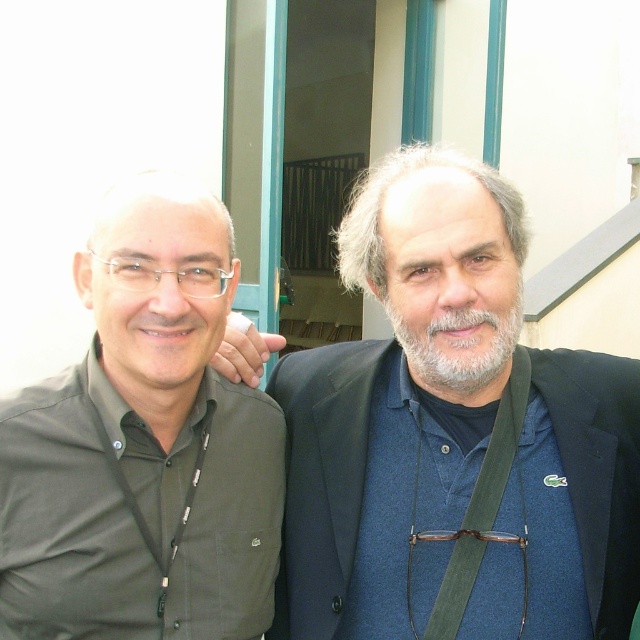
Question: Which point is farther from the camera taking this photo?

Choices:
 (A) (486, 397)
 (B) (161, 246)
 (C) (452, 268)

Answer: (A)

Question: Among these points, which one is nearest to the camera?

Choices:
 (A) (412, 627)
 (B) (268, 621)

Answer: (A)

Question: Is blue fabric shirt at center below black fabric lanyard at left?

Choices:
 (A) no
 (B) yes

Answer: (B)

Question: Which point appears closest to the camera in this image?

Choices:
 (A) (109, 445)
 (B) (492, 342)
 (C) (202, 547)
 (D) (502, 467)

Answer: (B)

Question: Is blue fabric shirt at center to the right of black fabric lanyard at left from the viewer's perspective?

Choices:
 (A) no
 (B) yes

Answer: (B)

Question: Is green matte shirt at left wider than black fabric lanyard at left?

Choices:
 (A) no
 (B) yes

Answer: (B)